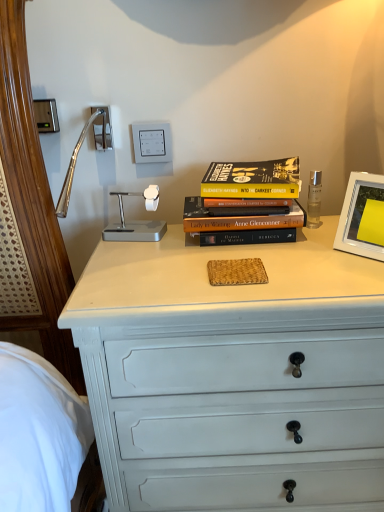
Find the location of `vacant region to the left of white plastic picture frame at upper right`. vacant region to the left of white plastic picture frame at upper right is located at coordinates (316, 262).